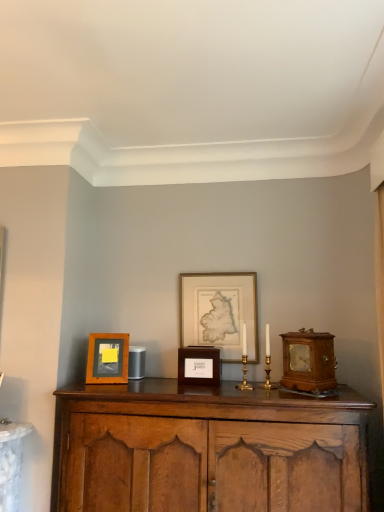
Question: Considering the positions of wooden alarm clock at right and wooden box at center, arranged as the second picture frame when viewed from the left, in the image, is wooden alarm clock at right wider or thinner than wooden box at center, arranged as the second picture frame when viewed from the left,?

Choices:
 (A) wide
 (B) thin

Answer: (B)

Question: Is wooden alarm clock at right taller or shorter than wooden box at center, arranged as the second picture frame when viewed from the left?

Choices:
 (A) tall
 (B) short

Answer: (A)

Question: Estimate the real-world distances between objects in this image. Which object is farther from the wooden cabinet at center?

Choices:
 (A) wooden frame at left, the 1th picture frame positioned from the left
 (B) wooden alarm clock at right
 (C) wooden box at center, which is the second picture frame in right-to-left order
 (D) gold-framed map at center, the third picture frame when ordered from left to right

Answer: (D)

Question: Considering the real-world distances, which object is farthest from the wooden box at center, which is the second picture frame in right-to-left order?

Choices:
 (A) wooden alarm clock at right
 (B) wooden frame at left, placed as the third picture frame when sorted from right to left
 (C) wooden cabinet at center
 (D) gold-framed map at center, which is the first picture frame from right to left

Answer: (A)